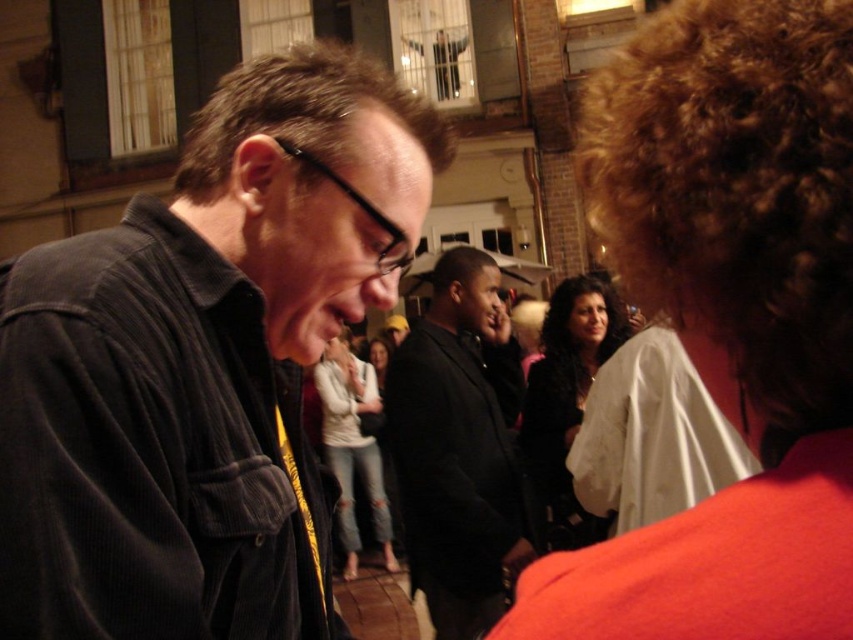
Question: Is shiny black hair at center bigger than ripped denim jeans at center?

Choices:
 (A) yes
 (B) no

Answer: (A)

Question: Which point is closer to the camera?

Choices:
 (A) (376, 451)
 (B) (13, 564)

Answer: (B)

Question: Which object is the farthest from the matte white shirt at center?

Choices:
 (A) dark corduroy jacket at center
 (B) shiny black hair at center
 (C) black matte suit at center
 (D) ripped denim jeans at center

Answer: (A)

Question: Is shiny black hair at center to the left of ripped denim jeans at center from the viewer's perspective?

Choices:
 (A) yes
 (B) no

Answer: (B)

Question: Which point appears closest to the camera in this image?

Choices:
 (A) (212, 292)
 (B) (379, 358)
 (C) (451, 419)
 (D) (345, 556)

Answer: (A)

Question: Can you confirm if dark corduroy jacket at center is positioned below black matte suit at center?

Choices:
 (A) yes
 (B) no

Answer: (B)